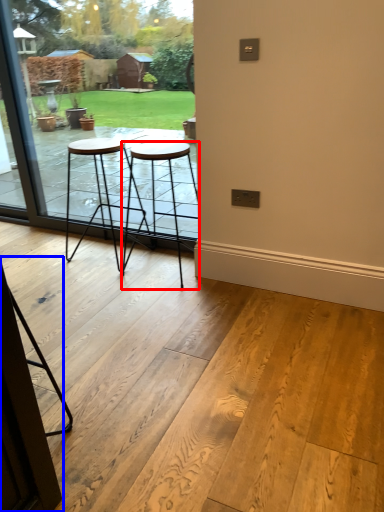
Question: Which object is further to the camera taking this photo, stool (highlighted by a red box) or screen door (highlighted by a blue box)?

Choices:
 (A) stool
 (B) screen door

Answer: (A)